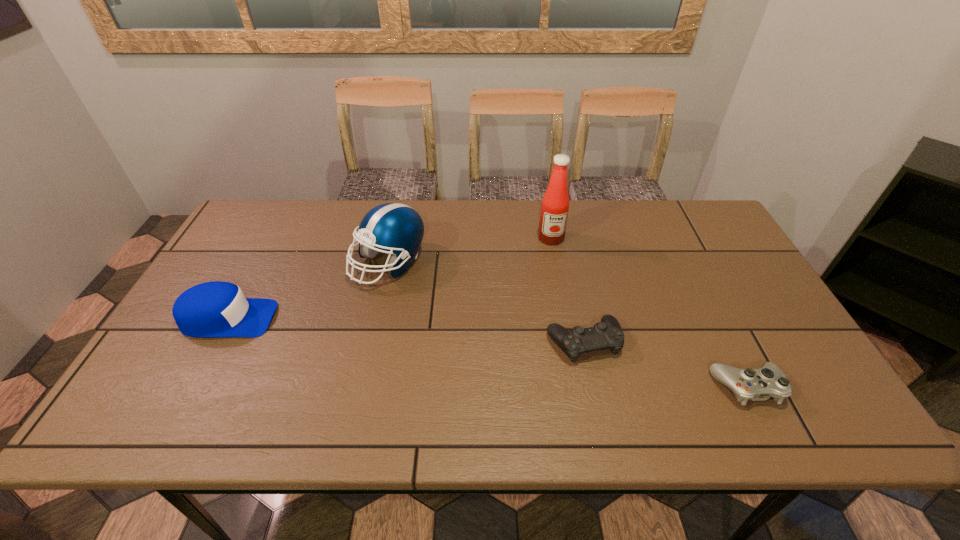
Identify the location of free point located on the front-facing side of the third shortest object. (363, 319).

Find the location of a particular element. free location located on the right of the farther control is located at coordinates (684, 342).

You are a GUI agent. You are given a task and a screenshot of the screen. Output one action in this format:
    pyautogui.click(x=<x>, y=<y>)
    Task: Click on the blank space located on the back of the nearer control
    
    Given the screenshot: What is the action you would take?
    pyautogui.click(x=682, y=255)

Identify the location of condiment that is at the far edge. This screenshot has height=540, width=960. (555, 204).

You are a GUI agent. You are given a task and a screenshot of the screen. Output one action in this format:
    pyautogui.click(x=<x>, y=<y>)
    Task: Click on the football helmet that is positioned at the far edge
    The height and width of the screenshot is (540, 960).
    Given the screenshot: What is the action you would take?
    pyautogui.click(x=394, y=227)

Where is `object situated at the near edge`? The image size is (960, 540). object situated at the near edge is located at coordinates (760, 384).

Where is `object at the left edge`? object at the left edge is located at coordinates (212, 309).

The image size is (960, 540). I want to click on object positioned at the right edge, so click(x=760, y=384).

Find the location of a particular element. The image size is (960, 540). object that is at the near right corner is located at coordinates (760, 384).

Locate an element on the screen. Image resolution: width=960 pixels, height=540 pixels. free location at the far edge is located at coordinates (578, 201).